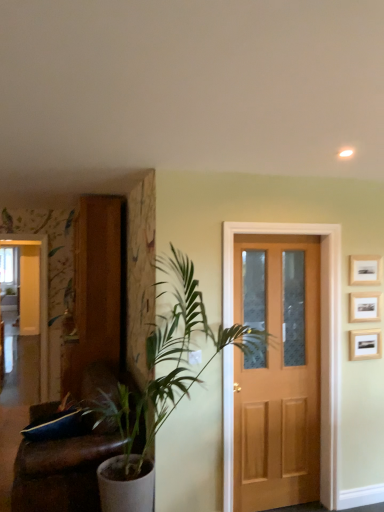
Question: Looking at their shapes, would you say wooden picture frame at upper right, arranged as the first picture frame when ordered from the bottom, is wider or thinner than white glossy elevator at left?

Choices:
 (A) thin
 (B) wide

Answer: (A)

Question: Considering the positions of wooden picture frame at upper right, the 3th picture frame viewed from the top, and white glossy elevator at left in the image, is wooden picture frame at upper right, the 3th picture frame viewed from the top, bigger or smaller than white glossy elevator at left?

Choices:
 (A) small
 (B) big

Answer: (A)

Question: Which object is positioned farthest from the light brown wood door at center?

Choices:
 (A) white glossy elevator at left
 (B) brown leather couch at left
 (C) green leafy plant at left
 (D) wooden picture frame at upper right, which ranks as the 2th picture frame in bottom-to-top order
 (E) wooden picture frame at upper right, the 3th picture frame viewed from the top

Answer: (A)

Question: Considering the real-world distances, which object is farthest from the wooden picture frame at upper right, placed as the second picture frame when sorted from top to bottom?

Choices:
 (A) white glossy elevator at left
 (B) light brown wood door at center
 (C) brown leather couch at left
 (D) wooden picture frame at upper right, arranged as the first picture frame when ordered from the bottom
 (E) wooden picture frame at upper right, the 3th picture frame from the bottom

Answer: (A)